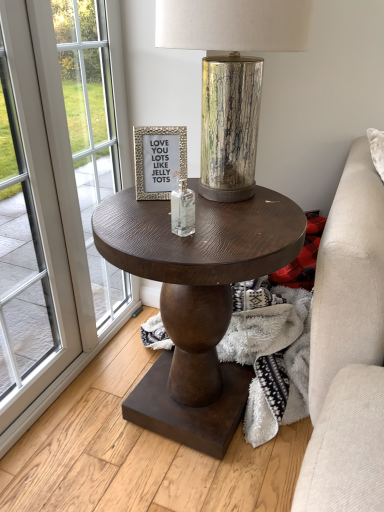
Looking at this image, measure the distance between point (154, 142) and camera.

1.09 meters.

Locate an element on the screen. The height and width of the screenshot is (512, 384). dark wood round table at center is located at coordinates (196, 302).

Where is `gold textured lamp at center`? gold textured lamp at center is located at coordinates (232, 75).

You are a GUI agent. You are given a task and a screenshot of the screen. Output one action in this format:
    pyautogui.click(x=<x>, y=<y>)
    Task: Click on the white glass window at left
    The width and height of the screenshot is (384, 512).
    Given the screenshot: What is the action you would take?
    pyautogui.click(x=20, y=255)

Which point is more distant from viewer, (266,6) or (87,356)?

The point (87,356) is farther.

Is gold textured lamp at center shorter than white glass screen door at left?

Correct, gold textured lamp at center is not as tall as white glass screen door at left.

From the image's perspective, is gold textured lamp at center located beneath white glass screen door at left?

No, from the image's perspective, gold textured lamp at center is not beneath white glass screen door at left.

Which of these two, gold textured lamp at center or white glass screen door at left, is thinner?

With smaller width is white glass screen door at left.

Could you tell me if clear glass bottle at center is turned towards white glass screen door at left?

No, clear glass bottle at center is not facing towards white glass screen door at left.

From the picture: Which of these two, clear glass bottle at center or white glass screen door at left, is bigger?

Bigger between the two is white glass screen door at left.

At what (x,y) coordinates should I click in order to perform the action: click on screen door below the clear glass bottle at center (from a real-world perspective). Please return your answer as a coordinate pair (x, y). Looking at the image, I should click on (60, 200).

Does point (193, 191) come closer to viewer compared to point (34, 101)?

Yes, it is.

Is white glass screen door at left not inside white glass window at left?

Actually, white glass screen door at left is at least partially inside white glass window at left.

In the scene shown: How much distance is there between white glass screen door at left and white glass window at left?

The distance of white glass screen door at left from white glass window at left is 4.43 inches.

Is there a large distance between white glass screen door at left and white glass window at left?

white glass screen door at left is near white glass window at left, not far away.

How different are the orientations of white glass screen door at left and white glass window at left in degrees?

0.808 degrees separate the facing orientations of white glass screen door at left and white glass window at left.

Are white glass screen door at left and dark wood round table at center located far from each other?

white glass screen door at left is near dark wood round table at center, not far away.

Which is correct: white glass screen door at left is inside dark wood round table at center, or outside of it?

white glass screen door at left is located beyond the bounds of dark wood round table at center.

Does white glass screen door at left turn towards dark wood round table at center?

No.

Considering the relative sizes of white glass screen door at left and dark wood round table at center in the image provided, is white glass screen door at left shorter than dark wood round table at center?

No.

Based on their sizes in the image, would you say dark wood round table at center is bigger or smaller than gold textured lamp at center?

Clearly, dark wood round table at center is larger in size than gold textured lamp at center.

Which of these two, dark wood round table at center or gold textured lamp at center, is thinner?

Thinner between the two is gold textured lamp at center.

The image size is (384, 512). What are the coordinates of `coffee table below the gold textured lamp at center (from a real-world perspective)` in the screenshot? It's located at (196, 302).

Is dark wood round table at center at the left side of gold textured lamp at center?

Indeed, dark wood round table at center is positioned on the left side of gold textured lamp at center.

What's the angular difference between silver textured frame at center and white glass screen door at left's facing directions?

The angle between the facing direction of silver textured frame at center and the facing direction of white glass screen door at left is 67.2 degrees.

Is silver textured frame at center completely or partially outside of white glass screen door at left?

Yes, silver textured frame at center is outside of white glass screen door at left.

Does silver textured frame at center have a lesser height compared to white glass screen door at left?

Correct, silver textured frame at center is not as tall as white glass screen door at left.

Is silver textured frame at center bigger than white glass screen door at left?

No.

In the scene shown: Does clear glass bottle at center have a larger size compared to white glass window at left?

Incorrect, clear glass bottle at center is not larger than white glass window at left.

From the image's perspective, which is below, clear glass bottle at center or white glass window at left?

white glass window at left is shown below in the image.

Is clear glass bottle at center not close to white glass window at left?

No, clear glass bottle at center is in close proximity to white glass window at left.

Do you think clear glass bottle at center is within white glass window at left, or outside of it?

clear glass bottle at center is outside white glass window at left.

Locate an element on the screen. This screenshot has width=384, height=512. lamp behind the white glass screen door at left is located at coordinates (232, 75).

I want to click on screen door that is on the left side of clear glass bottle at center, so click(x=60, y=200).

Considering their positions, is silver textured frame at center positioned closer to clear glass bottle at center than dark wood round table at center?

silver textured frame at center.

Based on the photo, considering their positions, is gold textured lamp at center positioned closer to clear glass bottle at center than dark wood round table at center?

gold textured lamp at center lies closer to clear glass bottle at center than the other object.

Estimate the real-world distances between objects in this image. Which object is closer to white glass screen door at left, silver textured frame at center or dark wood round table at center?

Based on the image, dark wood round table at center appears to be nearer to white glass screen door at left.

Considering their positions, is silver textured frame at center positioned closer to gold textured lamp at center than white glass screen door at left?

Among the two, silver textured frame at center is located nearer to gold textured lamp at center.

Estimate the real-world distances between objects in this image. Which object is closer to gold textured lamp at center, white glass window at left or dark wood round table at center?

dark wood round table at center is closer to gold textured lamp at center.

From the picture: Based on their spatial positions, is white glass screen door at left or gold textured lamp at center closer to dark wood round table at center?

gold textured lamp at center is positioned closer to the anchor dark wood round table at center.

From the image, which object appears to be farther from clear glass bottle at center, dark wood round table at center or white glass screen door at left?

white glass screen door at left is further to clear glass bottle at center.

When comparing their distances from gold textured lamp at center, does white glass window at left or white glass screen door at left seem further?

white glass window at left.

This screenshot has width=384, height=512. What are the coordinates of `coffee table located between white glass window at left and gold textured lamp at center in the left-right direction` in the screenshot? It's located at (196, 302).

This screenshot has height=512, width=384. In order to click on coffee table between white glass screen door at left and gold textured lamp at center in this screenshot , I will do `click(196, 302)`.

In order to click on window located between white glass screen door at left and dark wood round table at center in the left-right direction in this screenshot , I will do `click(20, 255)`.

You are a GUI agent. You are given a task and a screenshot of the screen. Output one action in this format:
    pyautogui.click(x=<x>, y=<y>)
    Task: Click on the picture frame situated between white glass window at left and gold textured lamp at center from left to right
    
    Given the screenshot: What is the action you would take?
    pyautogui.click(x=159, y=161)